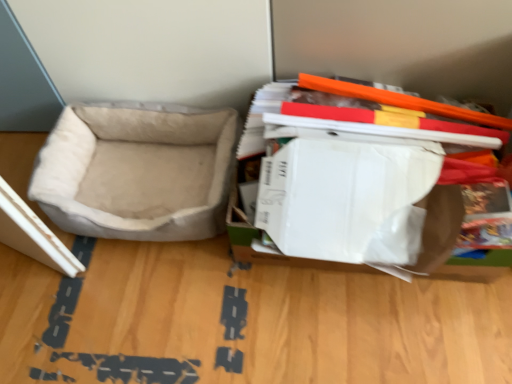
Question: Is white cardboard box at right far away from beige suede dog bed at left?

Choices:
 (A) no
 (B) yes

Answer: (A)

Question: Considering the relative sizes of white cardboard box at right and beige suede dog bed at left in the image provided, is white cardboard box at right bigger than beige suede dog bed at left?

Choices:
 (A) yes
 (B) no

Answer: (A)

Question: Is white cardboard box at right closer to camera compared to beige suede dog bed at left?

Choices:
 (A) no
 (B) yes

Answer: (B)

Question: Considering the relative positions of white cardboard box at right and beige suede dog bed at left in the image provided, is white cardboard box at right behind beige suede dog bed at left?

Choices:
 (A) yes
 (B) no

Answer: (B)

Question: Would you say white cardboard box at right contains beige suede dog bed at left?

Choices:
 (A) no
 (B) yes

Answer: (A)

Question: Considering the relative sizes of white cardboard box at right and beige suede dog bed at left in the image provided, is white cardboard box at right thinner than beige suede dog bed at left?

Choices:
 (A) yes
 (B) no

Answer: (B)

Question: Can you confirm if beige suede dog bed at left is shorter than white cardboard box at right?

Choices:
 (A) yes
 (B) no

Answer: (A)

Question: Is beige suede dog bed at left smaller than white cardboard box at right?

Choices:
 (A) no
 (B) yes

Answer: (B)

Question: Is beige suede dog bed at left looking in the opposite direction of white cardboard box at right?

Choices:
 (A) yes
 (B) no

Answer: (B)

Question: Can you confirm if beige suede dog bed at left is positioned to the left of white cardboard box at right?

Choices:
 (A) no
 (B) yes

Answer: (B)

Question: Could you tell me if beige suede dog bed at left is turned towards white cardboard box at right?

Choices:
 (A) no
 (B) yes

Answer: (A)

Question: Considering the relative sizes of beige suede dog bed at left and white cardboard box at right in the image provided, is beige suede dog bed at left taller than white cardboard box at right?

Choices:
 (A) yes
 (B) no

Answer: (B)

Question: Visually, is beige suede dog bed at left positioned to the left or to the right of white cardboard box at right?

Choices:
 (A) left
 (B) right

Answer: (A)